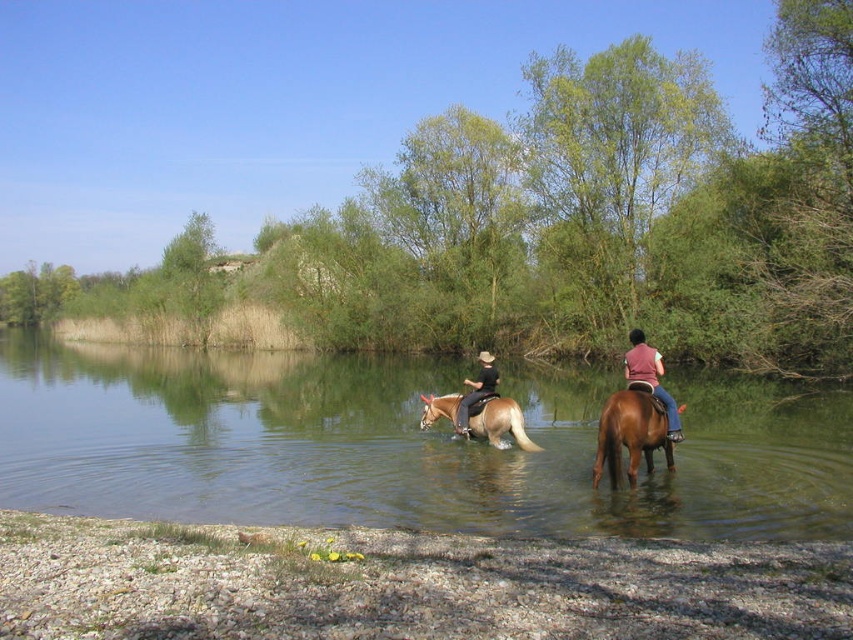
Question: Which of the following is the closest to the observer?

Choices:
 (A) (656, 381)
 (B) (468, 433)
 (C) (378, 419)

Answer: (A)

Question: Among these points, which one is nearest to the camera?

Choices:
 (A) (491, 438)
 (B) (230, 417)
 (C) (631, 384)

Answer: (C)

Question: Is brown glossy horse at center to the left of light brown glossy horse at center from the viewer's perspective?

Choices:
 (A) no
 (B) yes

Answer: (A)

Question: Does light brown glossy horse at center have a lesser width compared to brown leather vest at center?

Choices:
 (A) yes
 (B) no

Answer: (A)

Question: Which point appears farthest from the camera in this image?

Choices:
 (A) (648, 365)
 (B) (720, 394)
 (C) (485, 412)
 (D) (486, 368)

Answer: (B)

Question: Can you confirm if light brown glossy horse at center is positioned below dark brown leather pants at center?

Choices:
 (A) no
 (B) yes

Answer: (B)